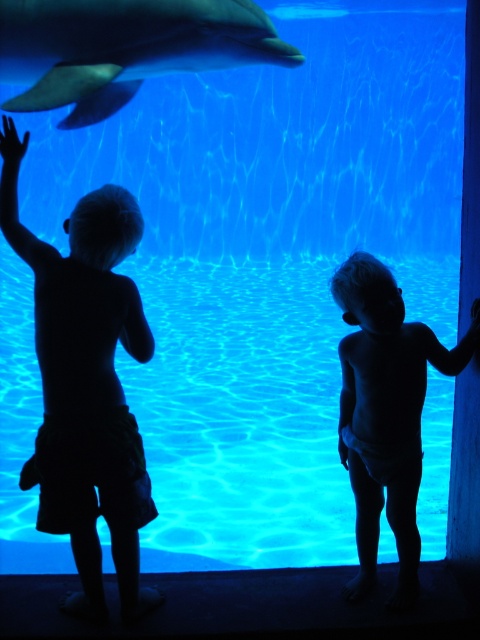
You are a marine biologist observing the dolphin exhibit. You notice the silhouette shorts at left and the smooth gray dolphin at upper center. Which object is taller in the image?

The silhouette shorts at left is taller than the smooth gray dolphin at upper center.

You are a security guard at the marine park. You need to locate the silhouette shorts at left. Where exactly is it located in the scene?

The silhouette shorts at left is located at point 0.602 on the x axis and 0.179 on the y axis.